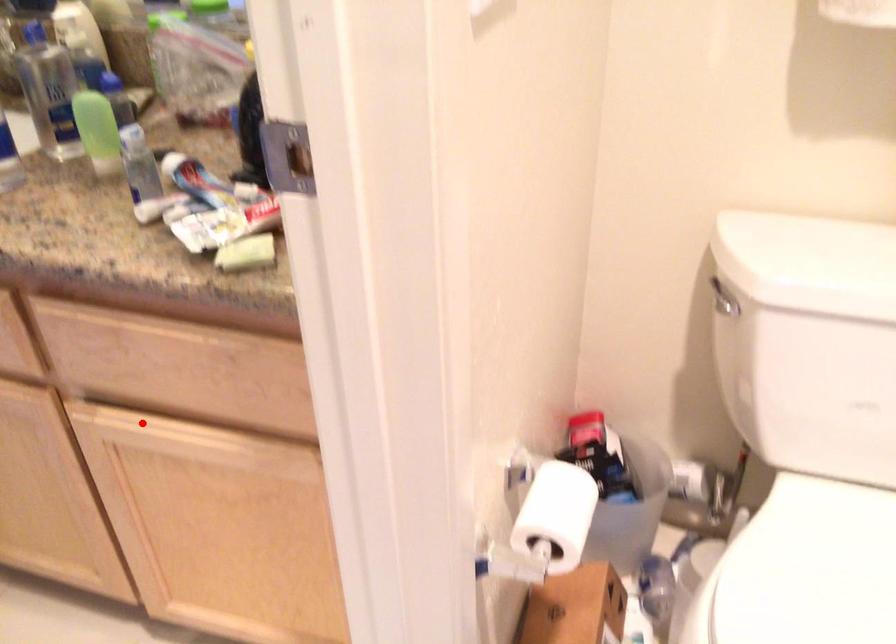
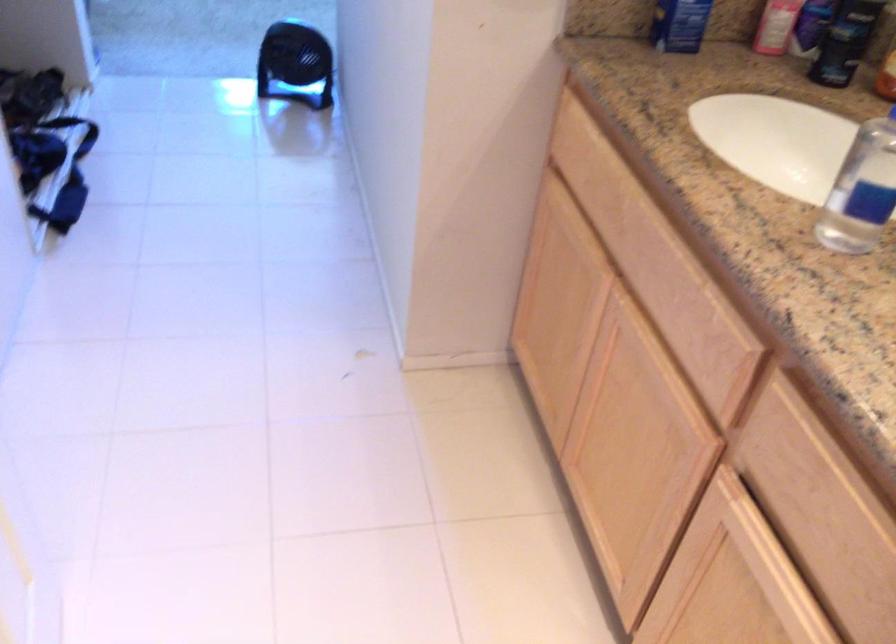
Question: I am providing you with two images of the same scene from different viewpoints. Image1 has a red point marked. In image2, the corresponding 3D location appears at what relative position? Reply with the corresponding letter.

Choices:
 (A) Closer
 (B) Farther

Answer: (A)